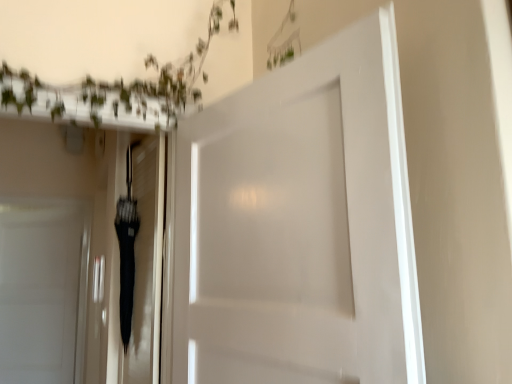
Question: Considering the positions of white matte door at left, arranged as the second door when viewed from the right, and black glossy umbrella at center in the image, is white matte door at left, arranged as the second door when viewed from the right, taller or shorter than black glossy umbrella at center?

Choices:
 (A) short
 (B) tall

Answer: (B)

Question: From a real-world perspective, is white matte door at left, the second door when ordered from front to back, above or below black glossy umbrella at center?

Choices:
 (A) above
 (B) below

Answer: (B)

Question: Estimate the real-world distances between objects in this image. Which object is closer to the white matte door at left, arranged as the first door when viewed from the left?

Choices:
 (A) black glossy umbrella at center
 (B) white matte door at center, placed as the first door when sorted from right to left

Answer: (A)

Question: Estimate the real-world distances between objects in this image. Which object is closer to the white matte door at left, the first door positioned from the back?

Choices:
 (A) white matte door at center, positioned as the second door in left-to-right order
 (B) black glossy umbrella at center

Answer: (B)